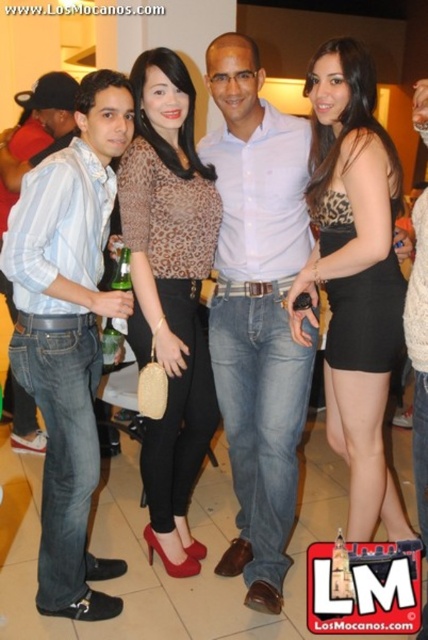
Who is more forward, (103, 92) or (359, 486)?

Point (103, 92) is in front.

Who is shorter, matte blue jeans at left or leopard print top at center?

Standing shorter between the two is leopard print top at center.

Does point (36, 172) lie in front of point (330, 262)?

Yes, it is in front of point (330, 262).

At what (x,y) coordinates should I click in order to perform the action: click on matte blue jeans at left. Please return your answer as a coordinate pair (x, y). The height and width of the screenshot is (640, 428). Looking at the image, I should click on (68, 333).

Does point (276, 547) lie behind point (357, 422)?

That is True.

Between light blue cotton shirt at center and leopard print top at center, which one has more height?

A: light blue cotton shirt at center

Between point (255, 156) and point (383, 472), which one is positioned behind?

Point (255, 156)

This screenshot has height=640, width=428. In order to click on light blue cotton shirt at center in this screenshot , I will do `click(258, 310)`.

Does light blue cotton shirt at center lie in front of jeans at center?

No, light blue cotton shirt at center is behind jeans at center.

Does light blue cotton shirt at center appear on the left side of jeans at center?

Indeed, light blue cotton shirt at center is positioned on the left side of jeans at center.

Is point (299, 198) positioned in front of point (407, 339)?

No, (299, 198) is further to viewer.

Identify the location of light blue cotton shirt at center. (258, 310).